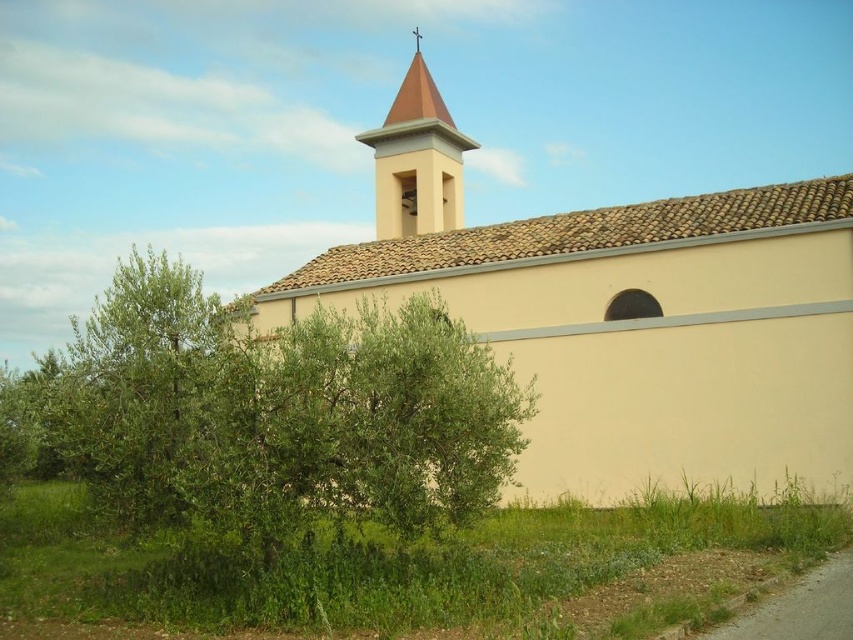
You are standing in front of the church and notice two points marked on the ground. The first point is labeled as point (524, 308) and the second is point (431, 88). Based on the scene description, which point is closer to the olive tree?

Point (524, 308) is in front of point (431, 88), so it is closer to the olive tree since the olive tree is in front of the church.

You are standing in front of the beige stucco church at center and want to see the green leafy tree at center clearly. Which direction should you move to get a better view of the tree without the church blocking your sight?

The green leafy tree at center is behind the beige stucco church at center, so you should move to the side of the church to get a better view of the tree without the church blocking your sight.

You are a photographer trying to capture the entire beige stucco church at center and the matte yellow bell tower at upper center in a single frame. Based on their sizes, will the church dominate the photo?

The beige stucco church at center is much taller than the matte yellow bell tower at upper center, so it will dominate the photo.